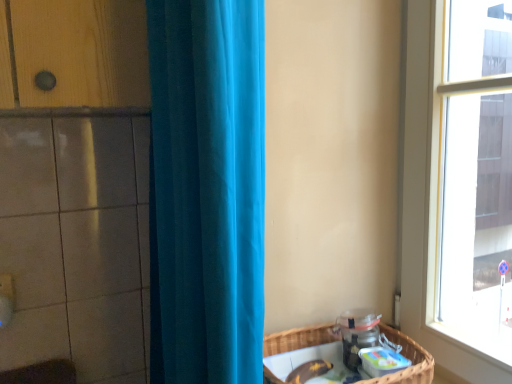
Describe the element at coordinates (408, 358) in the screenshot. I see `woven brown basket at lower right` at that location.

I want to click on woven brown basket at lower right, so click(408, 358).

At what (x,y) coordinates should I click in order to perform the action: click on teal fabric curtain at center. Please return your answer as a coordinate pair (x, y). Image resolution: width=512 pixels, height=384 pixels. Looking at the image, I should click on (206, 190).

The width and height of the screenshot is (512, 384). What do you see at coordinates (206, 190) in the screenshot?
I see `teal fabric curtain at center` at bounding box center [206, 190].

You are a GUI agent. You are given a task and a screenshot of the screen. Output one action in this format:
    pyautogui.click(x=<x>, y=<y>)
    Task: Click on the woven brown basket at lower right
    
    Given the screenshot: What is the action you would take?
    pyautogui.click(x=408, y=358)

Does woven brown basket at lower right appear on the right side of teal fabric curtain at center?

Indeed, woven brown basket at lower right is positioned on the right side of teal fabric curtain at center.

Is the depth of woven brown basket at lower right greater than that of teal fabric curtain at center?

Yes, woven brown basket at lower right is behind teal fabric curtain at center.

Which is behind, point (284, 373) or point (256, 236)?

The point (284, 373) is farther from the camera.

From the image's perspective, is woven brown basket at lower right above or below teal fabric curtain at center?

From the image's perspective, woven brown basket at lower right appears below teal fabric curtain at center.

From a real-world perspective, is woven brown basket at lower right physically above teal fabric curtain at center?

No, from a real-world perspective, woven brown basket at lower right is not over teal fabric curtain at center

Does woven brown basket at lower right have a greater width compared to teal fabric curtain at center?

Yes.

From their relative heights in the image, would you say woven brown basket at lower right is taller or shorter than teal fabric curtain at center?

Considering their sizes, woven brown basket at lower right has less height than teal fabric curtain at center.

Which of these two, woven brown basket at lower right or teal fabric curtain at center, is smaller?

woven brown basket at lower right.

Based on the photo, is woven brown basket at lower right outside of teal fabric curtain at center?

That's correct, woven brown basket at lower right is outside of teal fabric curtain at center.

Consider the image. Is woven brown basket at lower right next to teal fabric curtain at center?

No, woven brown basket at lower right is not touching teal fabric curtain at center.

Is woven brown basket at lower right facing towards teal fabric curtain at center?

Yes, woven brown basket at lower right is oriented towards teal fabric curtain at center.

In the scene shown: Can you tell me how much woven brown basket at lower right and teal fabric curtain at center differ in facing direction?

The angle between the facing direction of woven brown basket at lower right and the facing direction of teal fabric curtain at center is 0.0811 degrees.

I want to click on basket that appears below the teal fabric curtain at center (from the image's perspective), so click(x=408, y=358).

Can you confirm if teal fabric curtain at center is positioned to the right of woven brown basket at lower right?

No, teal fabric curtain at center is not to the right of woven brown basket at lower right.

Is the position of teal fabric curtain at center more distant than that of woven brown basket at lower right?

No, it is not.

Is point (151, 231) less distant than point (416, 354)?

That is False.

Based on the photo, from the image's perspective, which object appears higher, teal fabric curtain at center or woven brown basket at lower right?

teal fabric curtain at center, from the image's perspective.

From a real-world perspective, which is physically below, teal fabric curtain at center or woven brown basket at lower right?

woven brown basket at lower right.

Considering the sizes of objects teal fabric curtain at center and woven brown basket at lower right in the image provided, who is thinner, teal fabric curtain at center or woven brown basket at lower right?

Thinner between the two is teal fabric curtain at center.

Considering the sizes of teal fabric curtain at center and woven brown basket at lower right in the image, is teal fabric curtain at center taller or shorter than woven brown basket at lower right?

Considering their sizes, teal fabric curtain at center has more height than woven brown basket at lower right.

Considering the sizes of objects teal fabric curtain at center and woven brown basket at lower right in the image provided, who is bigger, teal fabric curtain at center or woven brown basket at lower right?

teal fabric curtain at center.

Do you think teal fabric curtain at center is within woven brown basket at lower right, or outside of it?

teal fabric curtain at center is spatially situated outside woven brown basket at lower right.

Is teal fabric curtain at center next to woven brown basket at lower right and touching it?

No.

Is teal fabric curtain at center aimed at woven brown basket at lower right?

Yes, teal fabric curtain at center is oriented towards woven brown basket at lower right.

Where is `curtain in front of the woven brown basket at lower right`? The image size is (512, 384). curtain in front of the woven brown basket at lower right is located at coordinates (206, 190).

This screenshot has height=384, width=512. What are the coordinates of `basket below the teal fabric curtain at center (from the image's perspective)` in the screenshot? It's located at (408, 358).

The height and width of the screenshot is (384, 512). I want to click on curtain above the woven brown basket at lower right (from the image's perspective), so click(x=206, y=190).